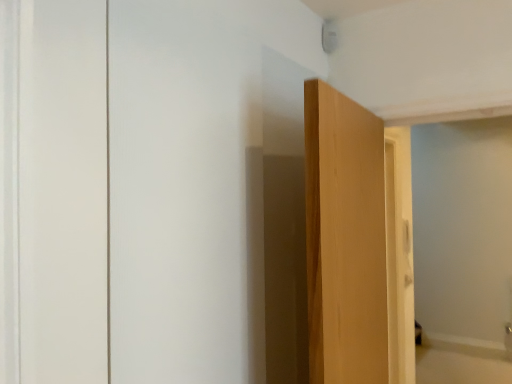
This screenshot has width=512, height=384. Find the location of `beige wood bathtub at lower right`. beige wood bathtub at lower right is located at coordinates (461, 361).

Describe the element at coordinates (461, 361) in the screenshot. Image resolution: width=512 pixels, height=384 pixels. I see `beige wood bathtub at lower right` at that location.

The image size is (512, 384). I want to click on light brown wood door at center, so click(357, 243).

What do you see at coordinates (357, 243) in the screenshot? Image resolution: width=512 pixels, height=384 pixels. I see `light brown wood door at center` at bounding box center [357, 243].

Identify the location of beige wood bathtub at lower right. (461, 361).

Which object is positioned more to the left, light brown wood door at center or beige wood bathtub at lower right?

Positioned to the left is light brown wood door at center.

Which object is more forward, light brown wood door at center or beige wood bathtub at lower right?

light brown wood door at center is in front.

Which point is more forward, (342, 130) or (494, 373)?

The point (342, 130) is in front.

From the image's perspective, relative to beige wood bathtub at lower right, is light brown wood door at center above or below?

light brown wood door at center is situated higher than beige wood bathtub at lower right in the image.

From the picture: From a real-world perspective, is light brown wood door at center positioned under beige wood bathtub at lower right based on gravity?

No, from a real-world perspective, light brown wood door at center is not under beige wood bathtub at lower right.

Which object is thinner, light brown wood door at center or beige wood bathtub at lower right?

Thinner between the two is light brown wood door at center.

Is light brown wood door at center shorter than beige wood bathtub at lower right?

Incorrect, the height of light brown wood door at center does not fall short of that of beige wood bathtub at lower right.

Considering the sizes of objects light brown wood door at center and beige wood bathtub at lower right in the image provided, who is smaller, light brown wood door at center or beige wood bathtub at lower right?

Smaller between the two is beige wood bathtub at lower right.

Choose the correct answer: Is light brown wood door at center inside beige wood bathtub at lower right or outside it?

light brown wood door at center is spatially situated outside beige wood bathtub at lower right.

Is light brown wood door at center directly adjacent to beige wood bathtub at lower right?

light brown wood door at center and beige wood bathtub at lower right are clearly separated.

Could you tell me if light brown wood door at center is turned towards beige wood bathtub at lower right?

No, light brown wood door at center is not turned towards beige wood bathtub at lower right.

What's the angular difference between light brown wood door at center and beige wood bathtub at lower right's facing directions?

They differ by 83.6 degrees in their facing directions.

Measure the distance between light brown wood door at center and beige wood bathtub at lower right.

light brown wood door at center and beige wood bathtub at lower right are 2.98 meters apart.

Where is `bath below the light brown wood door at center (from the image's perspective)`? The image size is (512, 384). bath below the light brown wood door at center (from the image's perspective) is located at coordinates point(461,361).

Which is more to the left, beige wood bathtub at lower right or light brown wood door at center?

From the viewer's perspective, light brown wood door at center appears more on the left side.

Relative to light brown wood door at center, is beige wood bathtub at lower right in front or behind?

In the image, beige wood bathtub at lower right appears behind light brown wood door at center.

From the picture: Which is less distant, (456, 357) or (321, 180)?

Clearly, point (456, 357) is more distant from the camera than point (321, 180).

From the image's perspective, who appears lower, beige wood bathtub at lower right or light brown wood door at center?

beige wood bathtub at lower right is shown below in the image.

From a real-world perspective, is beige wood bathtub at lower right positioned above or below light brown wood door at center?

In terms of real-world spatial position, beige wood bathtub at lower right is below light brown wood door at center.

In the scene shown: Considering the sizes of beige wood bathtub at lower right and light brown wood door at center in the image, is beige wood bathtub at lower right wider or thinner than light brown wood door at center?

beige wood bathtub at lower right is wider than light brown wood door at center.

Between beige wood bathtub at lower right and light brown wood door at center, which one has less height?

With less height is beige wood bathtub at lower right.

Is beige wood bathtub at lower right smaller than light brown wood door at center?

Indeed, beige wood bathtub at lower right has a smaller size compared to light brown wood door at center.

Is beige wood bathtub at lower right spatially inside light brown wood door at center, or outside of it?

The correct answer is: outside.

Is beige wood bathtub at lower right next to light brown wood door at center?

beige wood bathtub at lower right and light brown wood door at center are clearly separated.

Is beige wood bathtub at lower right facing away from light brown wood door at center?

No, light brown wood door at center is not at the back of beige wood bathtub at lower right.

What's the angular difference between beige wood bathtub at lower right and light brown wood door at center's facing directions?

The facing directions of beige wood bathtub at lower right and light brown wood door at center are 83.6 degrees apart.

This screenshot has width=512, height=384. What are the coordinates of `door in front of the beige wood bathtub at lower right` in the screenshot? It's located at (357, 243).

Identify the location of bath located behind the light brown wood door at center. (461, 361).

Locate an element on the screen. door that appears in front of the beige wood bathtub at lower right is located at coordinates (357, 243).